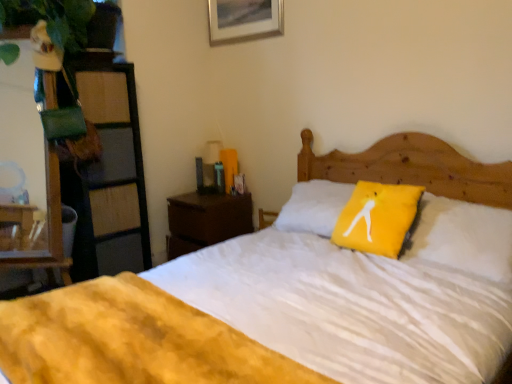
Question: Based on their positions, is white soft bed at center located to the left or right of brown wood nightstand at center?

Choices:
 (A) left
 (B) right

Answer: (B)

Question: In terms of height, does white soft bed at center look taller or shorter compared to brown wood nightstand at center?

Choices:
 (A) tall
 (B) short

Answer: (A)

Question: Which of these objects is positioned closest to the brown wood nightstand at center?

Choices:
 (A) white soft bed at center
 (B) metallic silver picture frame at upper center
 (C) yellow fabric pillow at center
 (D) wooden dresser at left

Answer: (D)

Question: Which is nearer to the metallic silver picture frame at upper center?

Choices:
 (A) wooden dresser at left
 (B) yellow fabric pillow at center
 (C) white soft bed at center
 (D) brown wood nightstand at center

Answer: (C)